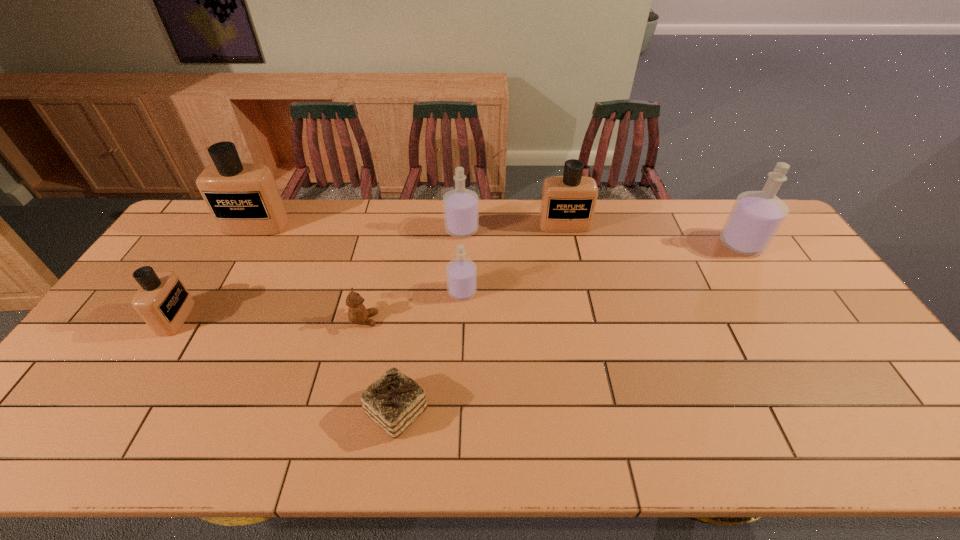
In order to click on the fourth object from left to right in this screenshot , I will do `click(394, 401)`.

Image resolution: width=960 pixels, height=540 pixels. In order to click on chocolate cake in this screenshot , I will do `click(394, 401)`.

Where is `free space located 0.140m on the front of the rightmost perfume`? The height and width of the screenshot is (540, 960). free space located 0.140m on the front of the rightmost perfume is located at coordinates (772, 291).

The width and height of the screenshot is (960, 540). I want to click on free space located on the front label of the biggest beige perfume, so click(x=231, y=269).

Identify the location of vacant position located on the front of the second smallest purple perfume. (461, 254).

Identify the location of vacant space located 0.200m on the front label of the seventh object from left to right. This screenshot has width=960, height=540. (575, 274).

Image resolution: width=960 pixels, height=540 pixels. Identify the location of free space located on the front label of the smallest beige perfume. (209, 318).

The height and width of the screenshot is (540, 960). Identify the location of vacant space located on the left of the smallest purple perfume. (323, 292).

The image size is (960, 540). Identify the location of free spot located 0.150m on the face of the brown teddy bear. (431, 320).

In order to click on vacant space located on the left of the chocolate cake in this screenshot , I will do pos(345,411).